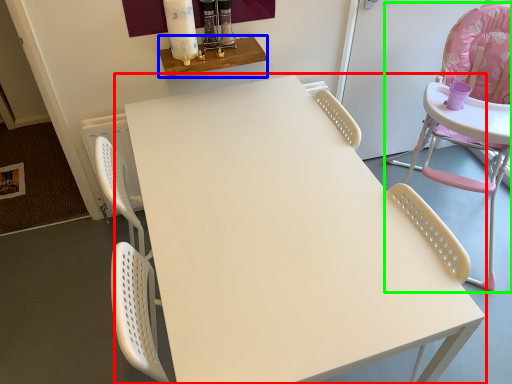
Question: Which is farther away from table (highlighted by a red box)? table (highlighted by a blue box) or chair (highlighted by a green box)?

Choices:
 (A) table
 (B) chair

Answer: (B)